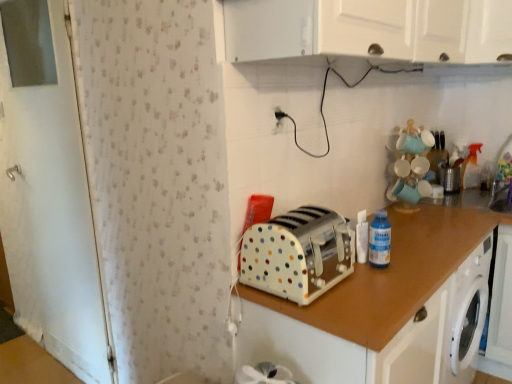
Find the location of `free space in front of blue plastic bottle at upper right`. free space in front of blue plastic bottle at upper right is located at coordinates (372, 286).